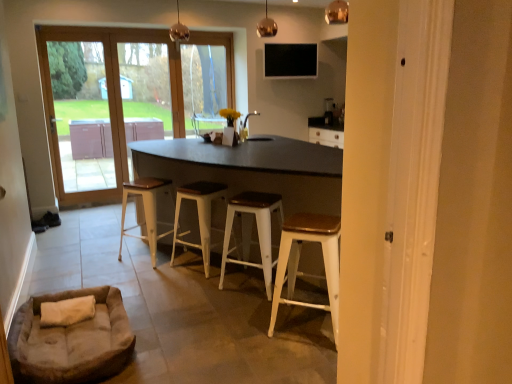
Question: Considering the relative positions of black matte tv at upper center and wooden seat white metal stool at center, marked as the third stool in a left-to-right arrangement, in the image provided, is black matte tv at upper center in front of wooden seat white metal stool at center, marked as the third stool in a left-to-right arrangement,?

Choices:
 (A) yes
 (B) no

Answer: (B)

Question: From the image's perspective, is black matte tv at upper center located above wooden seat white metal stool at center, marked as the second stool in a right-to-left arrangement?

Choices:
 (A) no
 (B) yes

Answer: (B)

Question: Considering the relative sizes of black matte tv at upper center and wooden seat white metal stool at center, marked as the second stool in a right-to-left arrangement, in the image provided, is black matte tv at upper center smaller than wooden seat white metal stool at center, marked as the second stool in a right-to-left arrangement,?

Choices:
 (A) no
 (B) yes

Answer: (B)

Question: Considering the relative sizes of black matte tv at upper center and wooden seat white metal stool at center, marked as the third stool in a left-to-right arrangement, in the image provided, is black matte tv at upper center taller than wooden seat white metal stool at center, marked as the third stool in a left-to-right arrangement,?

Choices:
 (A) no
 (B) yes

Answer: (A)

Question: Is black matte tv at upper center outside wooden seat white metal stool at center, marked as the second stool in a right-to-left arrangement?

Choices:
 (A) yes
 (B) no

Answer: (A)

Question: Is black matte tv at upper center aimed at wooden seat white metal stool at center, marked as the third stool in a left-to-right arrangement?

Choices:
 (A) yes
 (B) no

Answer: (B)

Question: From the image's perspective, is white metal stool at lower right, the fourth stool positioned from the left, on top of wooden seat white metal stool at center, marked as the third stool in a left-to-right arrangement?

Choices:
 (A) yes
 (B) no

Answer: (B)

Question: Does white metal stool at lower right, which is the 1th stool from right to left, have a larger size compared to wooden seat white metal stool at center, marked as the second stool in a right-to-left arrangement?

Choices:
 (A) no
 (B) yes

Answer: (A)

Question: Is white metal stool at lower right, the fourth stool positioned from the left, to the left of wooden seat white metal stool at center, marked as the third stool in a left-to-right arrangement, from the viewer's perspective?

Choices:
 (A) no
 (B) yes

Answer: (A)

Question: Is white metal stool at lower right, the fourth stool positioned from the left, behind wooden seat white metal stool at center, marked as the second stool in a right-to-left arrangement?

Choices:
 (A) no
 (B) yes

Answer: (A)

Question: Considering the relative sizes of white metal stool at lower right, which is the 1th stool from right to left, and wooden seat white metal stool at center, marked as the second stool in a right-to-left arrangement, in the image provided, is white metal stool at lower right, which is the 1th stool from right to left, smaller than wooden seat white metal stool at center, marked as the second stool in a right-to-left arrangement,?

Choices:
 (A) no
 (B) yes

Answer: (B)

Question: Considering the relative sizes of white metal stool at lower right, the fourth stool positioned from the left, and wooden seat white metal stool at center, marked as the third stool in a left-to-right arrangement, in the image provided, is white metal stool at lower right, the fourth stool positioned from the left, shorter than wooden seat white metal stool at center, marked as the third stool in a left-to-right arrangement,?

Choices:
 (A) no
 (B) yes

Answer: (A)

Question: Is wooden seat white metal stool at center, marked as the second stool in a right-to-left arrangement, oriented away from wooden seat white stool at center, the first stool from the left?

Choices:
 (A) no
 (B) yes

Answer: (A)